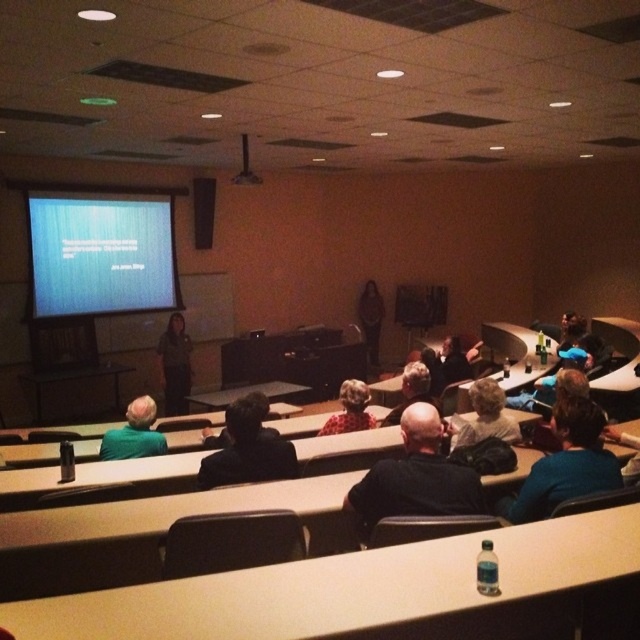
Question: Does black fabric jacket at center have a larger size compared to dark gray fabric jacket at center?

Choices:
 (A) yes
 (B) no

Answer: (B)

Question: Is black matte shirt at center positioned in front of dark brown leather jacket at center?

Choices:
 (A) no
 (B) yes

Answer: (B)

Question: Which point is closer to the camera?

Choices:
 (A) (333, 422)
 (B) (481, 417)
 (C) (168, 385)

Answer: (B)

Question: Based on their relative distances, which object is farther from the dark gray fabric jacket at center?

Choices:
 (A) light brown hair at center
 (B) red floral blouse at center
 (C) black matte speaker at upper center
 (D) dark gray hair at center

Answer: (A)

Question: Does black fabric jacket at center have a larger size compared to dark brown leather jacket at center?

Choices:
 (A) no
 (B) yes

Answer: (A)

Question: Which point is closer to the camera taking this photo?

Choices:
 (A) (200, 225)
 (B) (515, 442)
 (C) (429, 419)

Answer: (C)